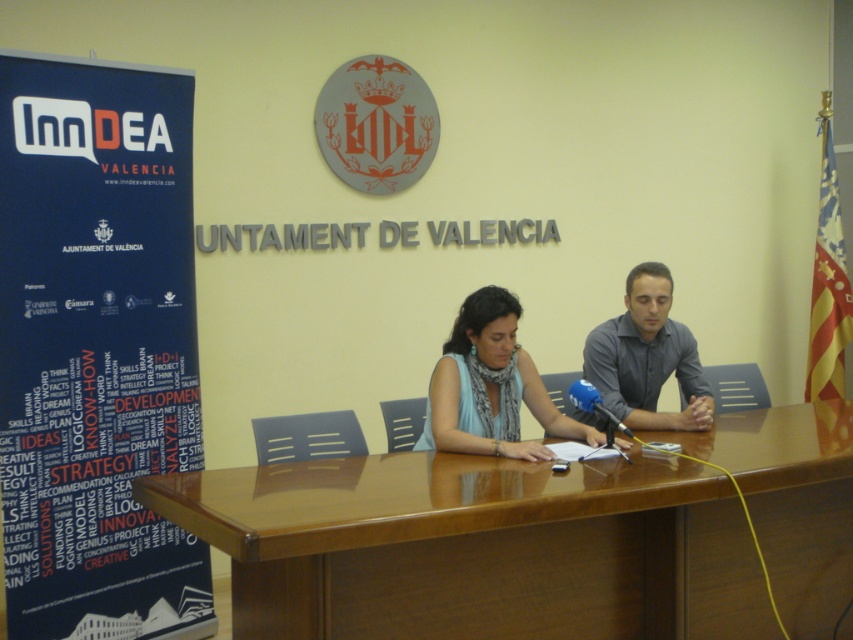
You are standing in front of the table at the press conference. There are two points marked on the table surface. One is at point coordinates (744, 529) and the other is at point coordinates (598, 349). Which point is closer to you?

Point (744, 529) is closer to you than point (598, 349).

You are organizing a press conference and need to place a name tag on the table. The name tag is the same size as the blue metallic microphone at center. Will the name tag fit on the table without overlapping the blue fabric scarf at center?

The blue fabric scarf at center is bigger than the blue metallic microphone at center. Since the name tag is the same size as the microphone, it will be smaller than the scarf. However, whether it fits without overlapping depends on the available space around the scarf. The scene description mentions the scarf is at the center, but doesn

You are organizing an event at the City Council of Valencia and need to place a decorative item between the blue fabric scarf at center and the blue metallic microphone at center. Which object should you place closer to the microphone to ensure the item fits within the space?

The blue metallic microphone at center is narrower than the blue fabric scarf at center, so placing the decorative item closer to the microphone would allow it to fit within the available space.